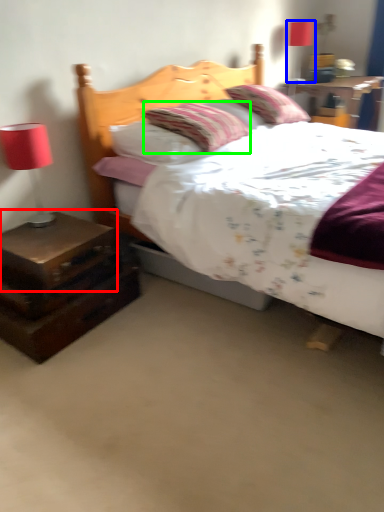
Question: Which object is positioned closest to nightstand (highlighted by a red box)? Select from table lamp (highlighted by a blue box) and pillow (highlighted by a green box).

Choices:
 (A) table lamp
 (B) pillow

Answer: (B)